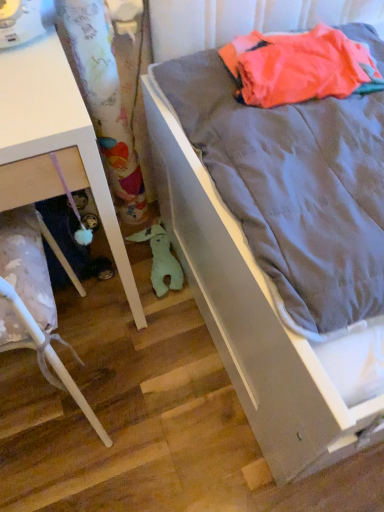
You are a GUI agent. You are given a task and a screenshot of the screen. Output one action in this format:
    pyautogui.click(x=<x>, y=<y>)
    Task: Click on the free space in front of green plush toy at lower center
    The height and width of the screenshot is (512, 384).
    Given the screenshot: What is the action you would take?
    pyautogui.click(x=148, y=326)